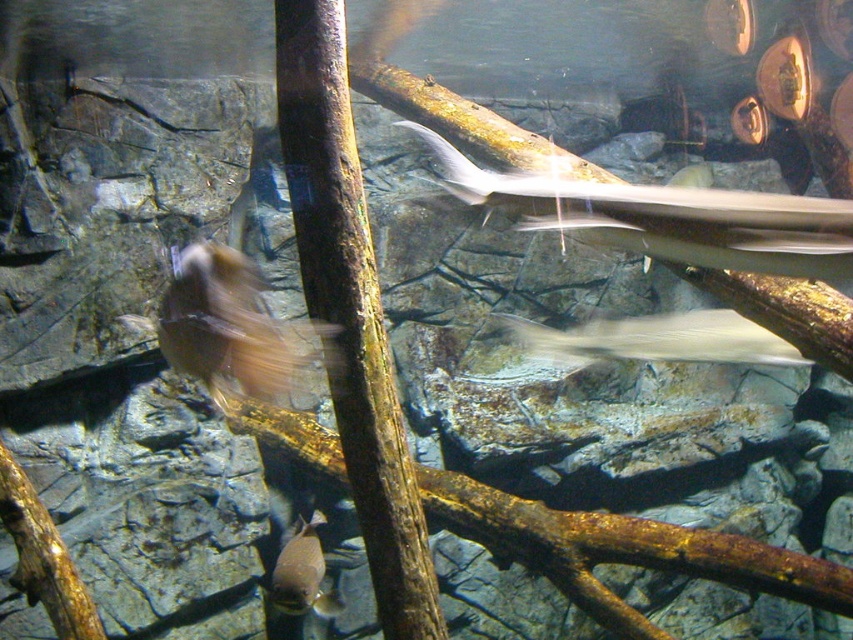
Measure the distance between silvery smooth shark at upper center and camera.

silvery smooth shark at upper center and camera are 7.15 feet apart from each other.

Is silvery smooth shark at upper center above translucent white shark at center?

Correct, silvery smooth shark at upper center is located above translucent white shark at center.

Does point (496, 200) come closer to viewer compared to point (543, 326)?

Yes, point (496, 200) is closer to viewer.

At what (x,y) coordinates should I click in order to perform the action: click on silvery smooth shark at upper center. Please return your answer as a coordinate pair (x, y). Looking at the image, I should click on (666, 218).

Which is below, translucent white shark at center or shiny silver fish at lower center?

shiny silver fish at lower center

Is translucent white shark at center wider than shiny silver fish at lower center?

Indeed, translucent white shark at center has a greater width compared to shiny silver fish at lower center.

Does point (595, 348) come farther from viewer compared to point (283, 566)?

No, (595, 348) is closer to viewer.

This screenshot has height=640, width=853. Find the location of `translucent white shark at center`. translucent white shark at center is located at coordinates (654, 339).

Where is `silvery smooth shark at upper center`? This screenshot has height=640, width=853. silvery smooth shark at upper center is located at coordinates (666, 218).

Find the location of a particular element. silvery smooth shark at upper center is located at coordinates point(666,218).